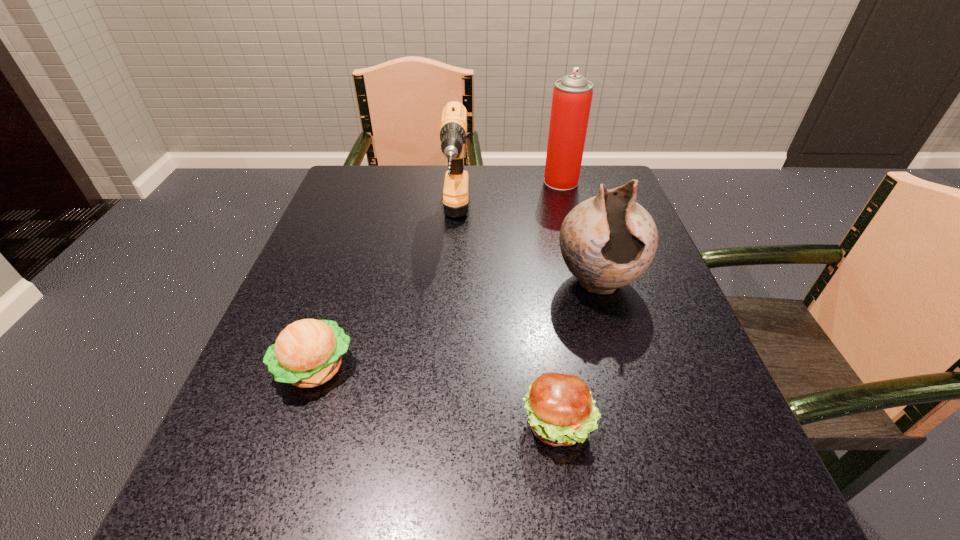
This screenshot has width=960, height=540. I want to click on aerosol can that is at the far edge, so click(x=572, y=95).

The height and width of the screenshot is (540, 960). What are the coordinates of `drill that is at the far edge` in the screenshot? It's located at (453, 127).

In order to click on object at the left edge in this screenshot , I will do `click(307, 353)`.

This screenshot has width=960, height=540. What are the coordinates of `aerosol can located at the right edge` in the screenshot? It's located at (572, 95).

Image resolution: width=960 pixels, height=540 pixels. I want to click on pottery at the right edge, so click(x=608, y=241).

You are a GUI agent. You are given a task and a screenshot of the screen. Output one action in this format:
    pyautogui.click(x=<x>, y=<y>)
    Task: Click on the object positioned at the far right corner
    This screenshot has height=540, width=960.
    Given the screenshot: What is the action you would take?
    pyautogui.click(x=572, y=95)

What are the coordinates of `free location at the far edge of the desktop` in the screenshot? It's located at (401, 214).

Locate an element on the screen. This screenshot has width=960, height=540. blank space at the left edge of the desktop is located at coordinates (307, 253).

At what (x,y) coordinates should I click in order to perform the action: click on vacant position at the right edge of the desktop. Please return your answer as a coordinate pair (x, y). The width and height of the screenshot is (960, 540). Looking at the image, I should click on (663, 271).

Identify the location of vacant space at the far left corner of the desktop. This screenshot has width=960, height=540. (378, 183).